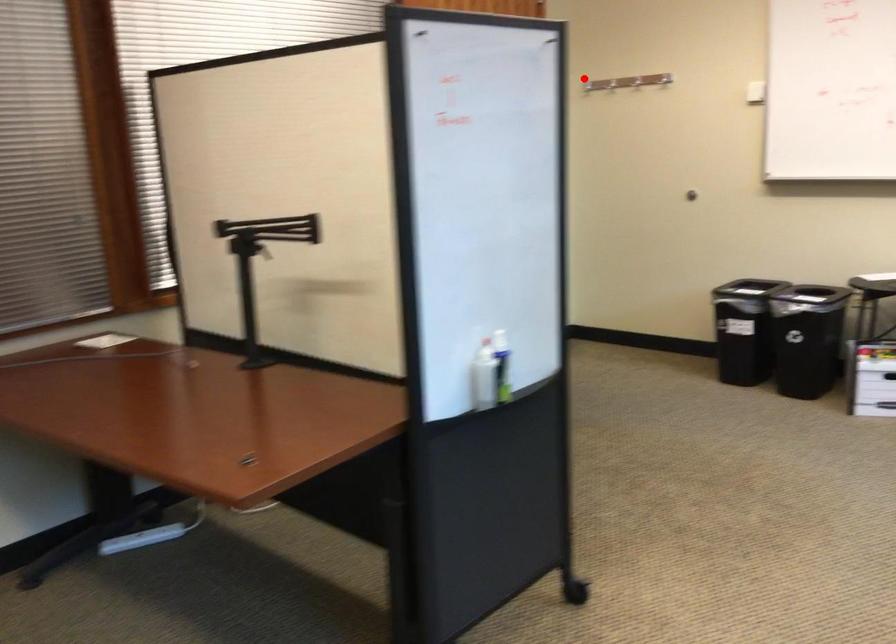
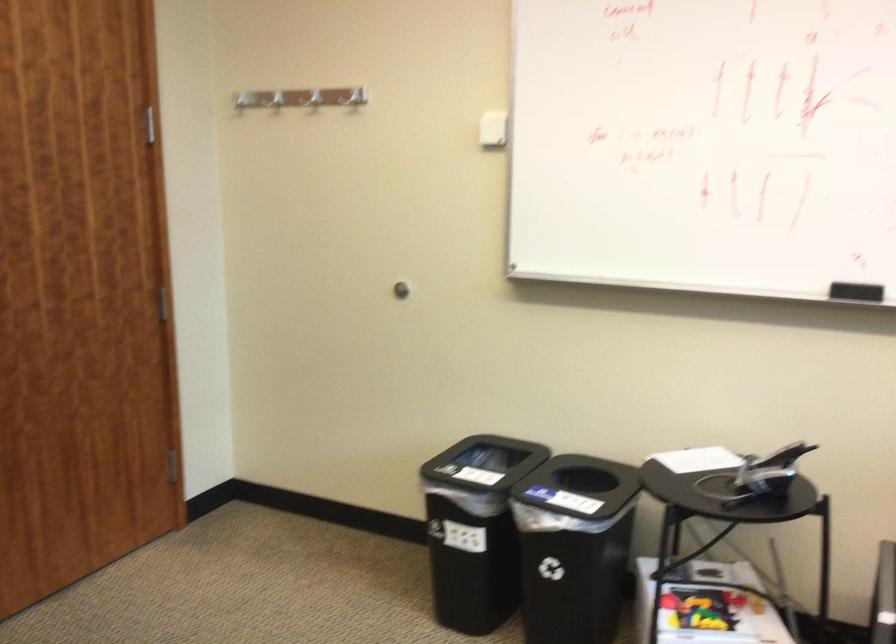
Question: A red point is marked in image1. In image2, is the corresponding 3D point closer to the camera or farther? Reply with the corresponding letter.

Choices:
 (A) The corresponding 3D point is closer.
 (B) The corresponding 3D point is farther.

Answer: (A)